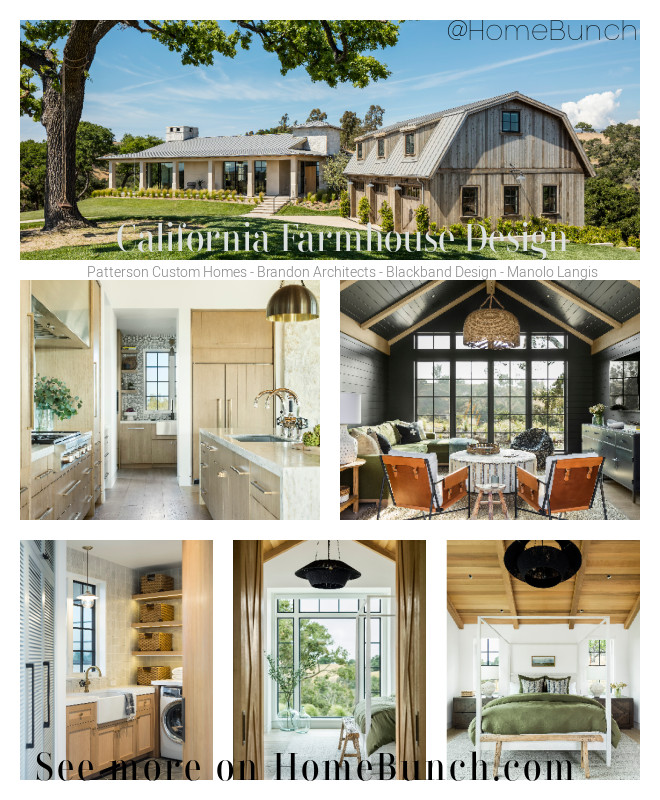
Where is `table`? Image resolution: width=660 pixels, height=800 pixels. table is located at coordinates (499, 462).